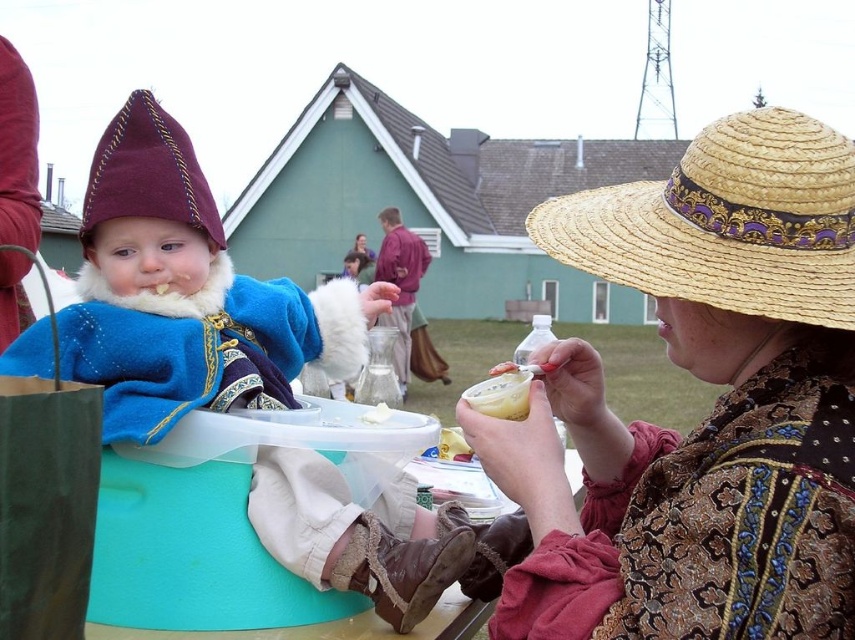
In the scene described, there is a velvet blue robe at center and a natural straw hat at center. Which object is taller?

The velvet blue robe at center is taller than the natural straw hat at center.

You are a stage designer preparing for a play. You need to place the velvet blue robe at center and the natural straw hat at center on a stage that is 2 meters wide. Can both items fit side by side without overlapping?

The distance between the velvet blue robe at center and natural straw hat at center is 1.90 meters, so they can fit side by side on a 2 meter wide stage since the total required space is less than the stage width.